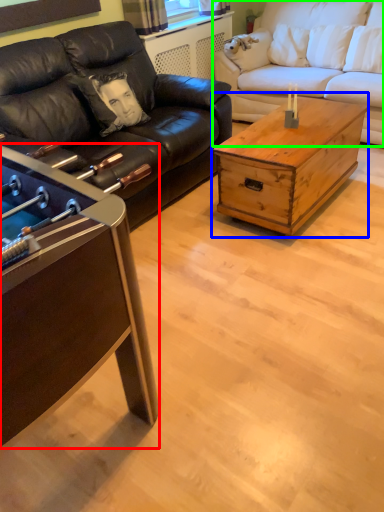
Question: Which object is the closest to the coffee table (highlighted by a red box)? Choose among these: coffee table (highlighted by a blue box) or studio couch (highlighted by a green box).

Choices:
 (A) coffee table
 (B) studio couch

Answer: (A)